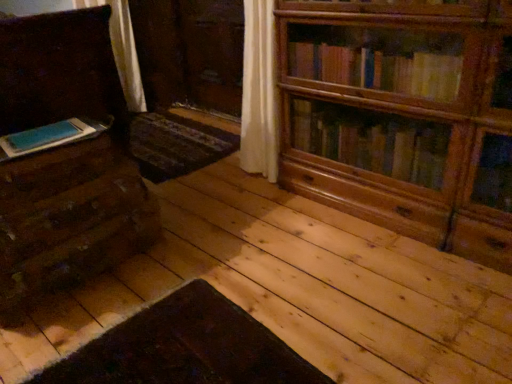
Find the location of a particular element. This screenshot has width=512, height=384. free location in front of wooden bookcase at upper right is located at coordinates (388, 291).